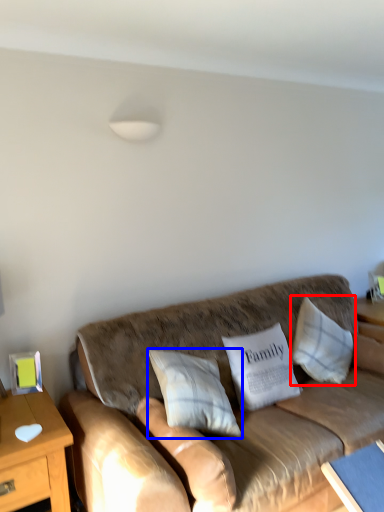
Question: Among these objects, which one is nearest to the camera, pillow (highlighted by a red box) or pillow (highlighted by a blue box)?

Choices:
 (A) pillow
 (B) pillow

Answer: (B)